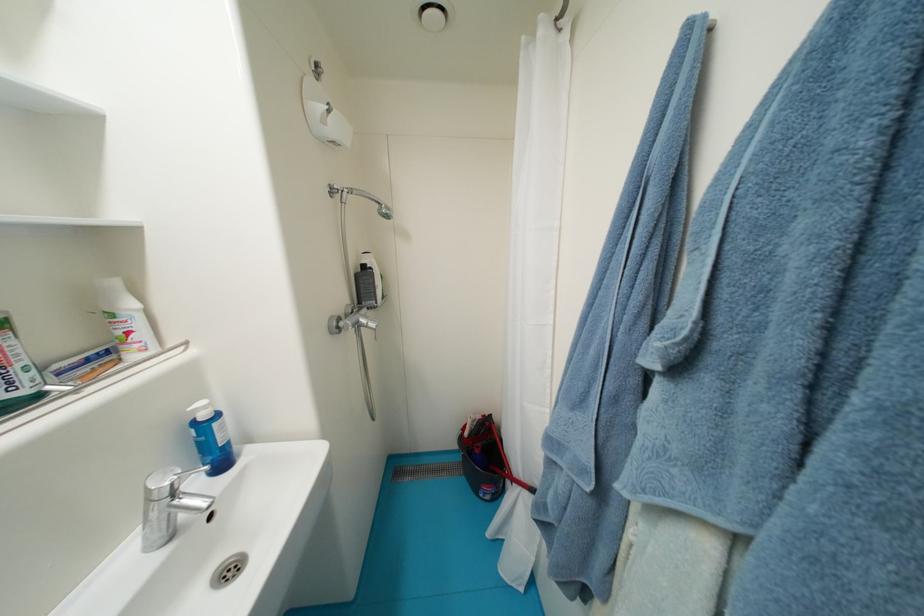
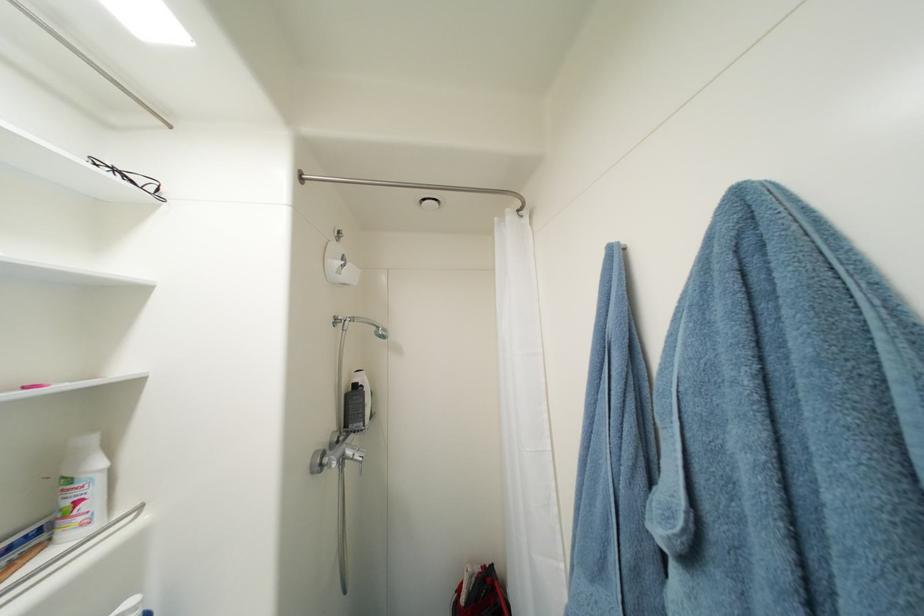
The point at (701, 325) is marked in the first image. Where is the corresponding point in the second image?

(691, 515)